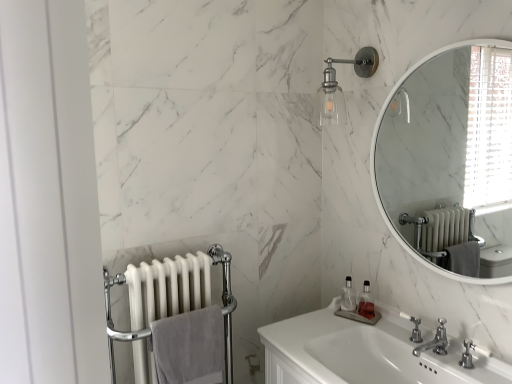
Question: Considering the positions of point (421, 339) and point (197, 375), is point (421, 339) closer or farther from the camera than point (197, 375)?

Choices:
 (A) closer
 (B) farther

Answer: (B)

Question: Is white plastic faucet at lower right, the first plumbing fixture positioned from the back, inside or outside of gray cotton towel at lower left?

Choices:
 (A) inside
 (B) outside

Answer: (B)

Question: Considering the real-world distances, which object is farthest from the clear glass sconce at upper center?

Choices:
 (A) white glossy sink at center
 (B) white glossy radiator at left
 (C) clear plastic soap dispenser at lower center, positioned as the 1th soap dispenser in left-to-right order
 (D) white plastic faucet at lower right, the second plumbing fixture positioned from the front
 (E) chrome metallic faucet at lower right, positioned as the second plumbing fixture in back-to-front order

Answer: (B)

Question: Which object is the farthest from the white plastic faucet at lower right, the second plumbing fixture positioned from the front?

Choices:
 (A) gray cotton towel at lower left
 (B) chrome metallic faucet at lower right, positioned as the second plumbing fixture in back-to-front order
 (C) white glossy sink at center
 (D) clear glass sconce at upper center
 (E) clear plastic soap dispenser at lower center, positioned as the 1th soap dispenser in left-to-right order

Answer: (D)